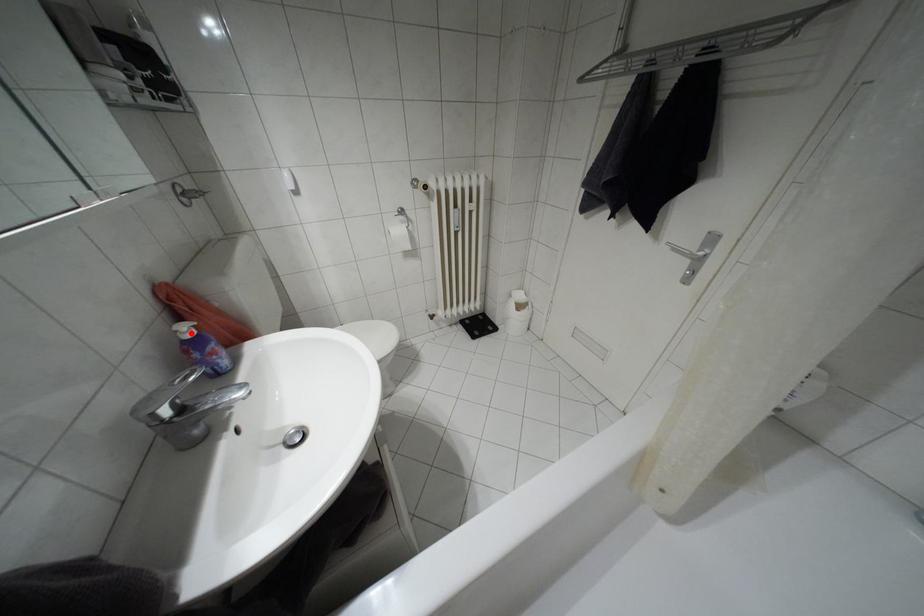
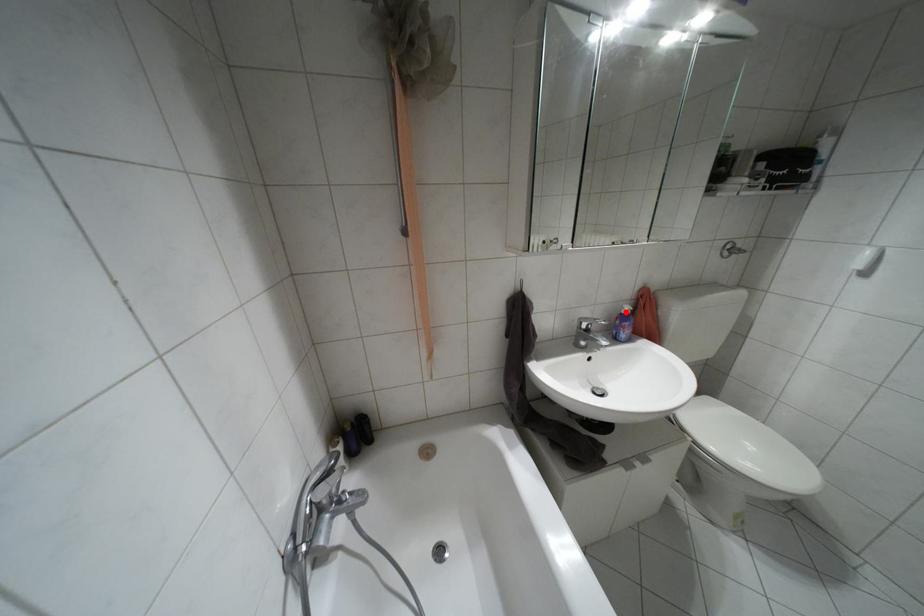
I am providing you with two images of the same scene from different viewpoints. A red point is marked on the first image and another point is marked on the second image. Do the highlighted points in image1 and image2 indicate the same real-world spot?

Yes